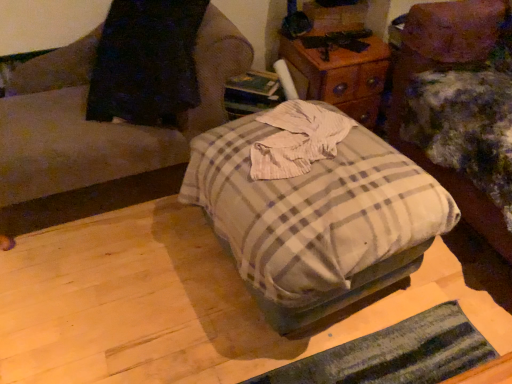
The image size is (512, 384). In order to click on free space that is to the left of plaid fabric ottoman at center in this screenshot , I will do `click(122, 296)`.